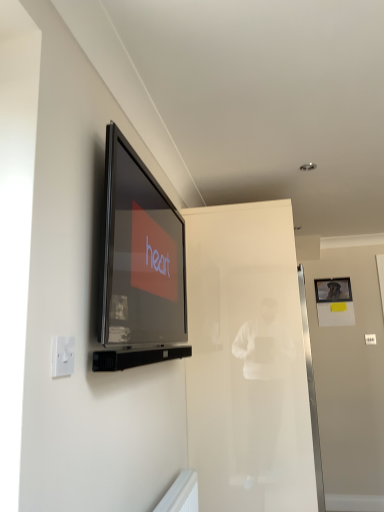
Question: From a real-world perspective, relative to metallic silver picture frame at upper right, is matte black television at upper left vertically above or below?

Choices:
 (A) above
 (B) below

Answer: (B)

Question: Is matte black television at upper left to the left or to the right of metallic silver picture frame at upper right in the image?

Choices:
 (A) right
 (B) left

Answer: (B)

Question: Which of these objects is positioned closest to the white plastic electric outlet at lower left?

Choices:
 (A) metallic silver picture frame at upper right
 (B) white plastic light switch at upper left
 (C) matte black television at upper left
 (D) transparent glass door at center

Answer: (C)

Question: Estimate the real-world distances between objects in this image. Which object is closer to the metallic silver picture frame at upper right?

Choices:
 (A) matte black television at upper left
 (B) white plastic light switch at upper left
 (C) transparent glass door at center
 (D) white plastic electric outlet at lower left

Answer: (B)